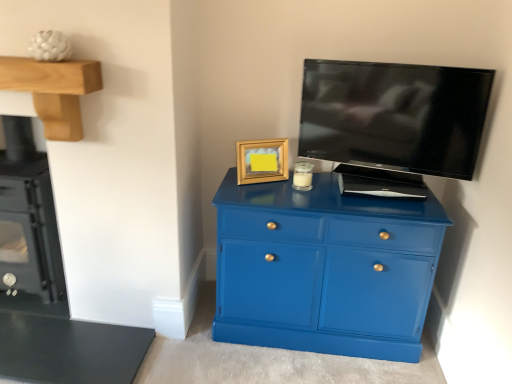
This screenshot has height=384, width=512. What are the coordinates of `free location to the right of gold wooden picture frame at upper center` in the screenshot? It's located at (288, 187).